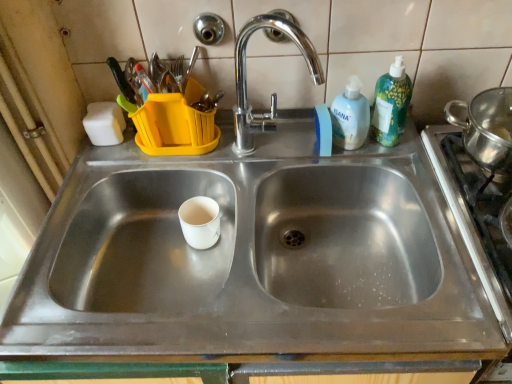
Find the location of a particular element. free space in front of white matte sponge at upper left is located at coordinates click(x=100, y=168).